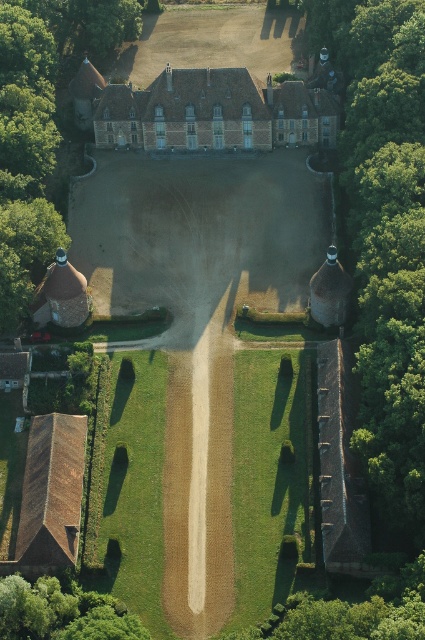
You are a landscape architect planning to add a new pathway between the green leafy tree at upper left and the green leafy tree at lower left. Considering their sizes, which tree will require more space to accommodate its width?

The green leafy tree at upper left has a larger width than the green leafy tree at lower left, so it will require more space to accommodate its width.

You are a drone operator tasked with capturing aerial footage of the grand estate. You need to fly your drone from point A to point B, which are two specific locations marked in the image. The coordinates for point A are at (311,100), and point B is 168.35 meters away from point A. Given that your drone has a maximum flight range of 150 meters before needing to return, can you safely fly from point A to point B without running out of battery?

The distance between point A at (311,100) and point B is 168.35 meters. Since the drone can only fly up to 150 meters before needing to return, it cannot safely reach point B from point A without exceeding its range.

You are standing at the entrance of the estate and want to take a photo that includes both point (3, 317) and point (36, 614). Which point should you position closer to the camera to ensure both are in the frame?

Point (3, 317) is closer to the viewer than point (36, 614), so you should position yourself closer to point (3, 317) to ensure both points are within the camera frame.